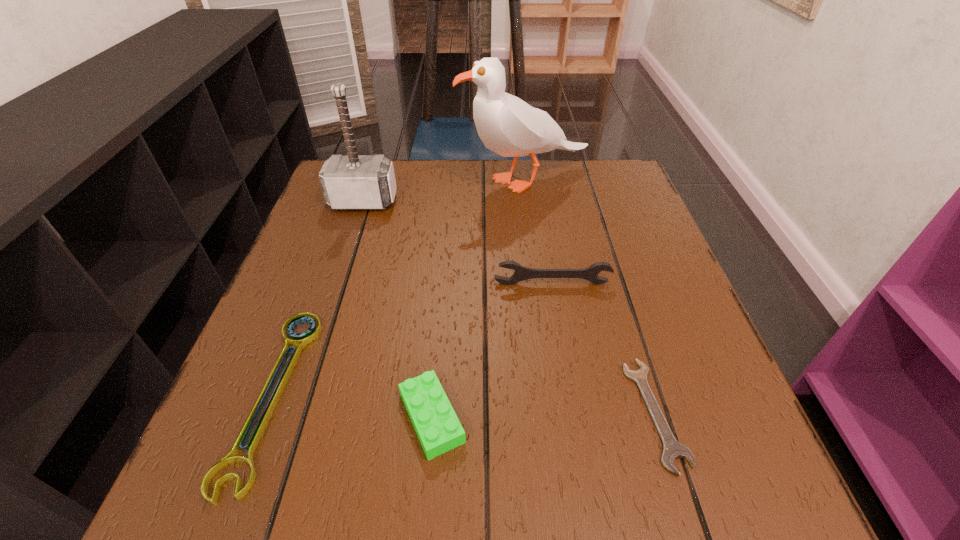
Where is `free spot located 0.190m at the beak of the gull`? The image size is (960, 540). free spot located 0.190m at the beak of the gull is located at coordinates (386, 180).

At what (x,y) coordinates should I click in order to perform the action: click on vacant point located 0.050m for striking with the head of the hammer. Please return your answer as a coordinate pair (x, y). The image size is (960, 540). Looking at the image, I should click on (355, 226).

This screenshot has height=540, width=960. In order to click on vacant space positioned 0.240m on the open ends of the farthest wrench in this screenshot , I will do `click(570, 391)`.

Find the location of `vacant space located on the back of the Lego`. vacant space located on the back of the Lego is located at coordinates (443, 285).

Locate an element on the screen. This screenshot has width=960, height=540. free space located 0.260m on the back of the second shortest wrench is located at coordinates (335, 231).

I want to click on vacant position located 0.220m on the back of the shortest object, so click(612, 272).

Identify the location of gull present at the far edge. (508, 126).

You are a GUI agent. You are given a task and a screenshot of the screen. Output one action in this format:
    pyautogui.click(x=<x>, y=<y>)
    Task: Click on the hammer that is at the far edge
    Image resolution: width=960 pixels, height=540 pixels.
    Given the screenshot: What is the action you would take?
    pyautogui.click(x=350, y=182)

Image resolution: width=960 pixels, height=540 pixels. Identify the location of Lego that is positioned at the near edge. (438, 428).

This screenshot has width=960, height=540. Identify the location of hammer located in the left edge section of the desktop. (350, 182).